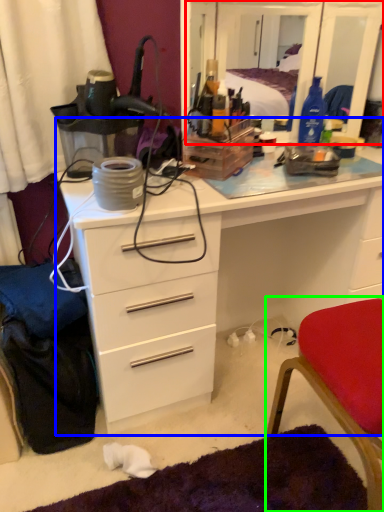
Question: Which object is the farthest from mirror (highlighted by a red box)? Choose among these: chest of drawers (highlighted by a blue box) or chair (highlighted by a green box).

Choices:
 (A) chest of drawers
 (B) chair

Answer: (B)